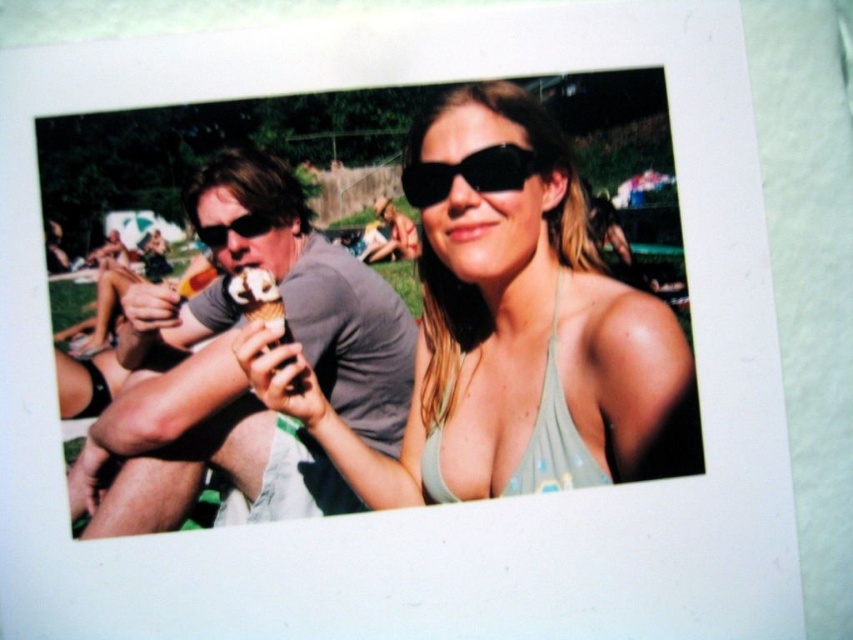
You are trying to decide which item to pack for a trip. You have a bag with limited space. Based on the image, can you determine if the matte gray tank top at center will fit in your bag if the matte black sunglasses at center is already occupying the space?

Answer: The matte gray tank top at center might be wider than matte black sunglasses at center, so there is a possibility that the tank top may not fit in the bag if the sunglasses are already taking up the space.

You are standing in the scene and want to move from the point at coordinates point (471, 385) to the point at coordinates point (267, 230). Which direction should you face to walk towards the second point?

To move from point (471, 385) to point (267, 230), you should face towards the lower left direction since point (267, 230) is located lower and to the left compared to point (471, 385).